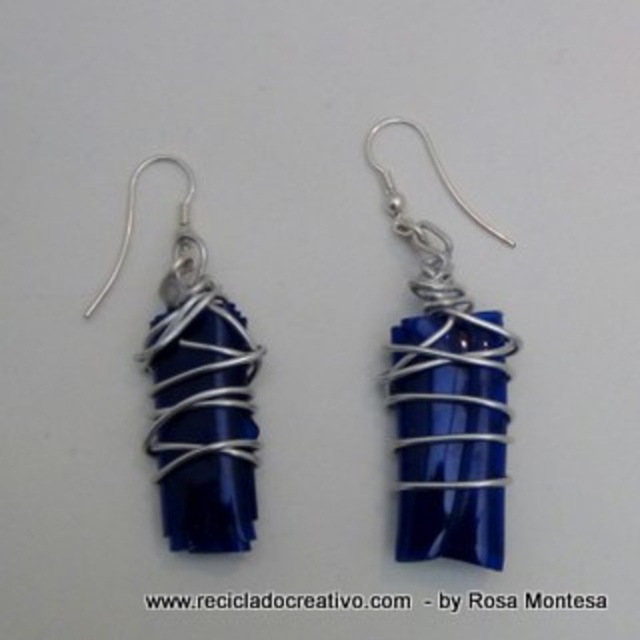
Question: Which of the following is the farthest from the observer?

Choices:
 (A) blue glossy stone at center
 (B) blue glass wire at right

Answer: (A)

Question: Does blue glass wire at right lie in front of blue glossy stone at center?

Choices:
 (A) yes
 (B) no

Answer: (A)

Question: Does blue glass wire at right come in front of blue glossy stone at center?

Choices:
 (A) yes
 (B) no

Answer: (A)

Question: Does blue glass wire at right appear on the right side of blue glossy stone at center?

Choices:
 (A) no
 (B) yes

Answer: (B)

Question: Which object is farther from the camera taking this photo?

Choices:
 (A) blue glass wire at right
 (B) blue glossy stone at center

Answer: (B)

Question: Which object appears closest to the camera in this image?

Choices:
 (A) blue glossy stone at center
 (B) blue glass wire at right

Answer: (B)